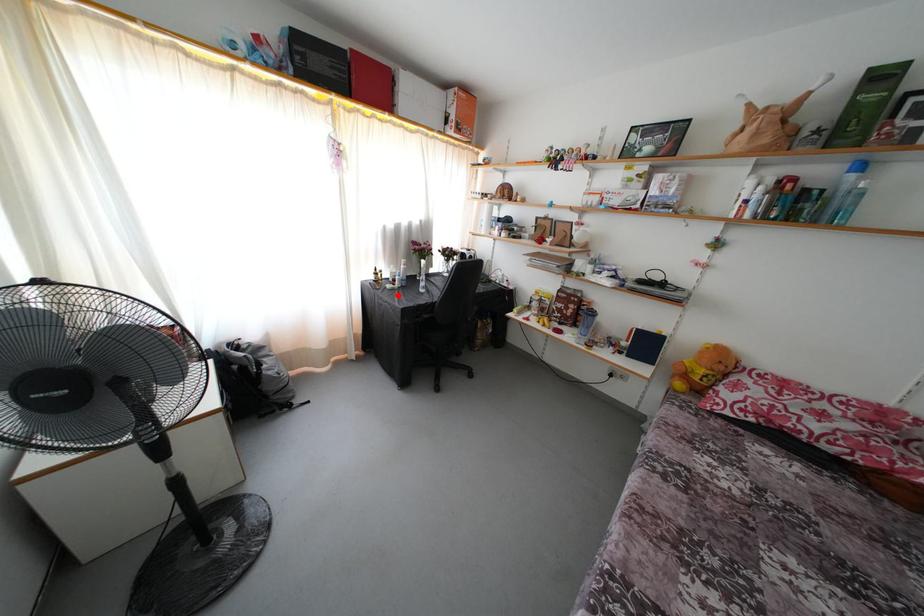
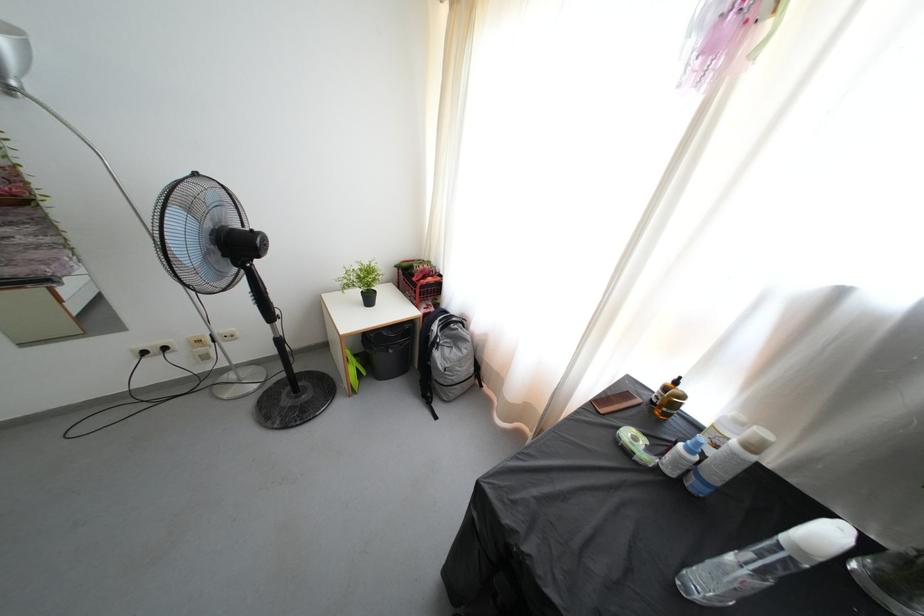
Find the pixel in the second image that matches the highlighted location in the first image.

(631, 458)